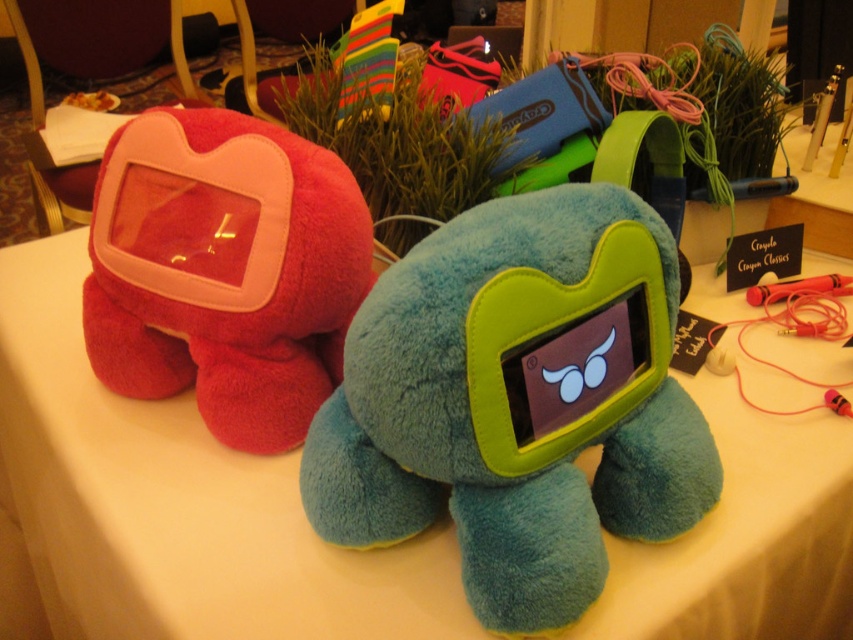
Question: Observing the image, what is the correct spatial positioning of white cloth at center in reference to teal plush toy at center?

Choices:
 (A) right
 (B) left

Answer: (B)

Question: Estimate the real-world distances between objects in this image. Which object is farther from the white cloth at center?

Choices:
 (A) matte pink plush at left
 (B) teal plush toy at center

Answer: (B)

Question: Among these objects, which one is nearest to the camera?

Choices:
 (A) white cloth at center
 (B) matte pink plush at left

Answer: (A)

Question: From the image, what is the correct spatial relationship of white cloth at center in relation to teal plush toy at center?

Choices:
 (A) right
 (B) left

Answer: (B)

Question: Can you confirm if white cloth at center is positioned to the left of teal plush toy at center?

Choices:
 (A) no
 (B) yes

Answer: (B)

Question: Estimate the real-world distances between objects in this image. Which object is farther from the teal plush toy at center?

Choices:
 (A) matte pink plush at left
 (B) white cloth at center

Answer: (A)